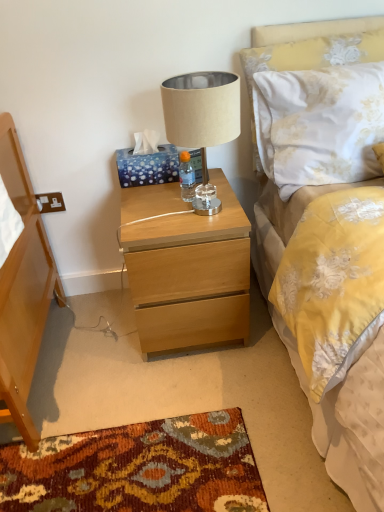
Locate an element on the screen. The height and width of the screenshot is (512, 384). unoccupied space behind clear plastic bottle at center is located at coordinates (184, 182).